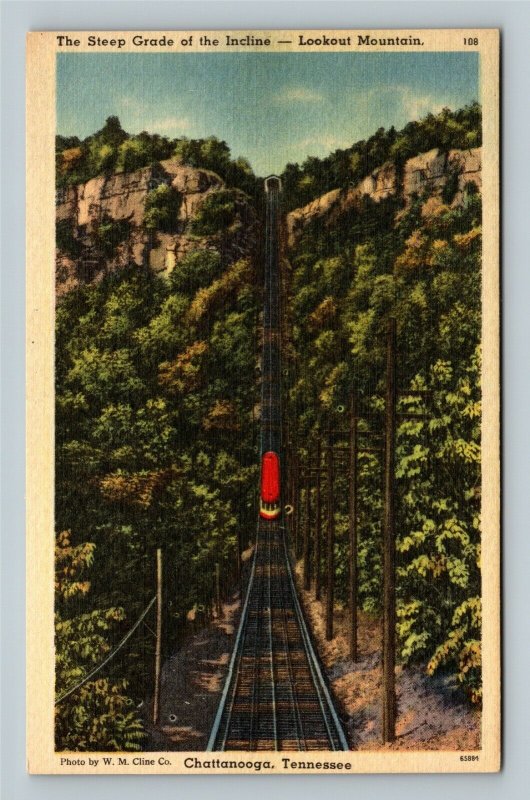
Where is `cables`? This screenshot has width=530, height=800. cables is located at coordinates (267, 317).